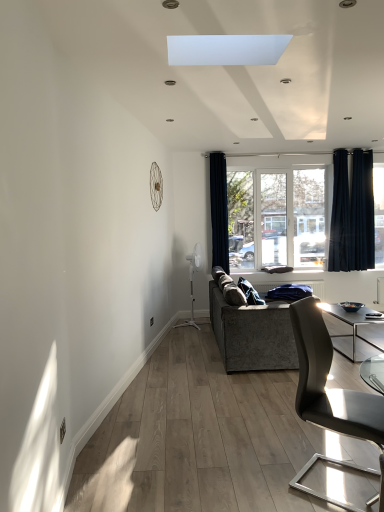
Where is `free point behind matte black chair at lower right`? This screenshot has height=512, width=384. free point behind matte black chair at lower right is located at coordinates coord(309,441).